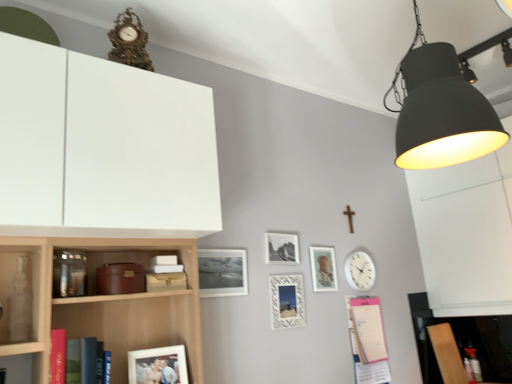
Question: Is matte silver picture frame at center-right, the 5th picture frame from the left, wider than pink paper notepad at lower right, which appears as the 1th book when viewed from the right?

Choices:
 (A) yes
 (B) no

Answer: (B)

Question: From the image's perspective, would you say matte silver picture frame at center-right, placed as the fifth picture frame when sorted from front to back, is shown under pink paper notepad at lower right, which is the first book from bottom to top?

Choices:
 (A) yes
 (B) no

Answer: (B)

Question: Is matte silver picture frame at center-right, the 5th picture frame from the left, not inside pink paper notepad at lower right, which is the 1th book from back to front?

Choices:
 (A) yes
 (B) no

Answer: (A)

Question: Is matte silver picture frame at center-right, which is the first picture frame in back-to-front order, positioned in front of pink paper notepad at lower right, which is the 1th book from back to front?

Choices:
 (A) no
 (B) yes

Answer: (A)

Question: Is there a large distance between matte silver picture frame at center-right, placed as the fifth picture frame when sorted from front to back, and pink paper notepad at lower right, which appears as the 2th book when viewed from the front?

Choices:
 (A) no
 (B) yes

Answer: (A)

Question: Considering the relative positions of matte silver picture frame at center-right, placed as the fifth picture frame when sorted from front to back, and pink paper notepad at lower right, which is the first book from bottom to top, in the image provided, is matte silver picture frame at center-right, placed as the fifth picture frame when sorted from front to back, to the right of pink paper notepad at lower right, which is the first book from bottom to top, from the viewer's perspective?

Choices:
 (A) yes
 (B) no

Answer: (B)

Question: Considering the relative sizes of white matte picture frame at lower center, positioned as the first picture frame in front-to-back order, and metallic silver frame at center, the 3th picture frame in the left-to-right sequence, in the image provided, is white matte picture frame at lower center, positioned as the first picture frame in front-to-back order, thinner than metallic silver frame at center, the 3th picture frame in the left-to-right sequence,?

Choices:
 (A) no
 (B) yes

Answer: (A)

Question: From the image's perspective, is white matte picture frame at lower center, which is the 1th picture frame in left-to-right order, located beneath metallic silver frame at center, the 3th picture frame in the left-to-right sequence?

Choices:
 (A) no
 (B) yes

Answer: (B)

Question: Can you confirm if white matte picture frame at lower center, which is counted as the 5th picture frame, starting from the right, is positioned to the right of metallic silver frame at center, positioned as the fourth picture frame in front-to-back order?

Choices:
 (A) yes
 (B) no

Answer: (B)

Question: Does white matte picture frame at lower center, positioned as the first picture frame in front-to-back order, have a greater height compared to metallic silver frame at center, the 3th picture frame in the left-to-right sequence?

Choices:
 (A) no
 (B) yes

Answer: (A)

Question: Can you confirm if white matte picture frame at lower center, which is the 1th picture frame in left-to-right order, is shorter than metallic silver frame at center, the 3th picture frame when ordered from right to left?

Choices:
 (A) no
 (B) yes

Answer: (B)

Question: Is white matte picture frame at lower center, which is counted as the 5th picture frame, starting from the right, not near metallic silver frame at center, placed as the second picture frame when sorted from back to front?

Choices:
 (A) no
 (B) yes

Answer: (A)

Question: Are pink paper notepad at lower right, which is the first book from bottom to top, and hardcover book at left, the 2th book from the right, making contact?

Choices:
 (A) no
 (B) yes

Answer: (A)